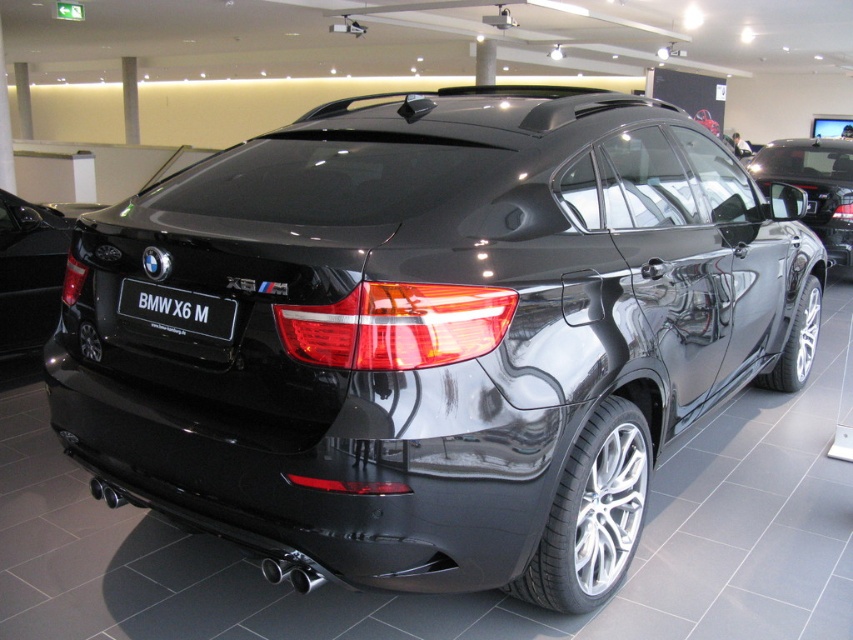
Question: Observing the image, what is the correct spatial positioning of glossy black car at right in reference to black glossy license plate at center?

Choices:
 (A) below
 (B) above

Answer: (B)

Question: Which of the following is the farthest from the observer?

Choices:
 (A) glossy black car at right
 (B) black glossy license plate at center
 (C) glossy black car at center

Answer: (A)

Question: Is glossy black car at right bigger than black glossy license plate at center?

Choices:
 (A) yes
 (B) no

Answer: (A)

Question: Is glossy black car at right positioned behind black glossy license plate at center?

Choices:
 (A) yes
 (B) no

Answer: (A)

Question: Which point is closer to the camera?

Choices:
 (A) glossy black car at right
 (B) black glossy license plate at center

Answer: (B)

Question: Among these points, which one is farthest from the camera?

Choices:
 (A) (149, 292)
 (B) (51, 296)
 (C) (848, 172)

Answer: (C)